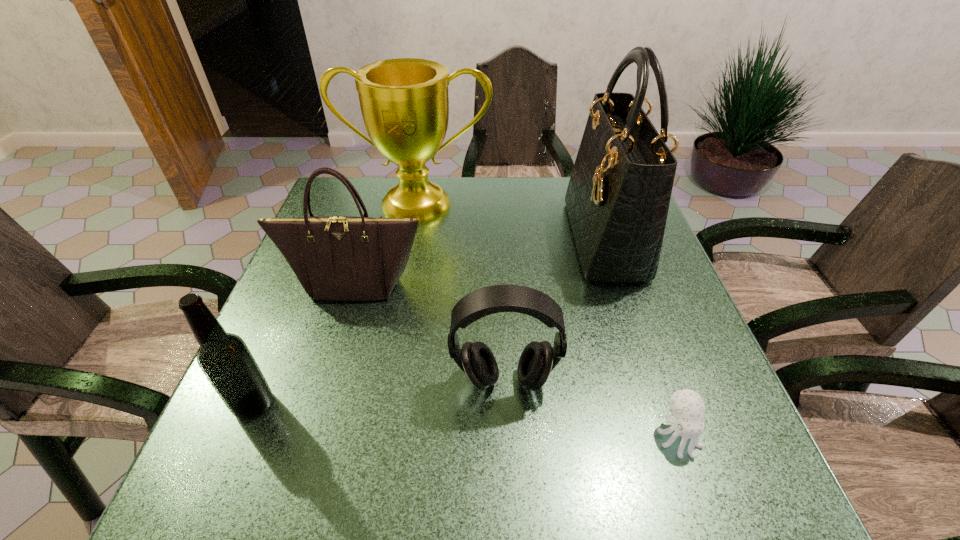
You are a GUI agent. You are given a task and a screenshot of the screen. Output one action in this format:
    pyautogui.click(x=<x>, y=<y>)
    Task: Click on the vacant space located on the shiny surface of the award
    This screenshot has width=960, height=540.
    Given the screenshot: What is the action you would take?
    pyautogui.click(x=413, y=239)

You are a GUI agent. You are given a task and a screenshot of the screen. Output one action in this format:
    pyautogui.click(x=<x>, y=<y>)
    Task: Click on the vacant space located on the front-facing side of the shorter handbag
    The height and width of the screenshot is (540, 960).
    Given the screenshot: What is the action you would take?
    pyautogui.click(x=297, y=477)

The width and height of the screenshot is (960, 540). I want to click on blank area located 0.170m on the back of the beer bottle, so click(x=289, y=320).

Find the location of a particular element. Image resolution: width=960 pixels, height=540 pixels. vacant space positioned on the ear cups of the earphone is located at coordinates 509,465.

What are the coordinates of `free space located on the front-facing side of the octopus` in the screenshot? It's located at (697, 491).

Where is `handbag that is at the far edge`? This screenshot has height=540, width=960. handbag that is at the far edge is located at coordinates (618, 196).

This screenshot has width=960, height=540. I want to click on award that is at the far edge, so click(404, 102).

The width and height of the screenshot is (960, 540). I want to click on object that is at the near edge, so click(x=687, y=406).

In order to click on award located at the left edge in this screenshot , I will do point(404,102).

This screenshot has height=540, width=960. What are the coordinates of `handbag that is at the left edge` in the screenshot? It's located at (336, 258).